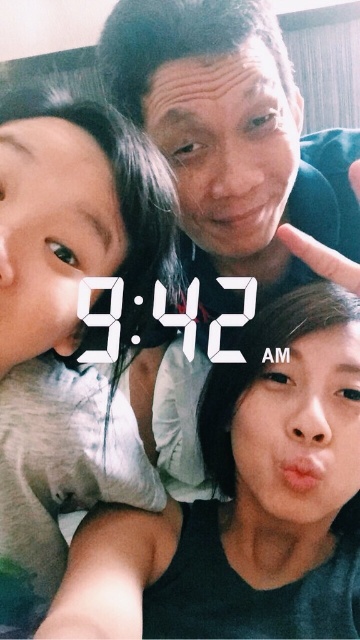
You are a photographer adjusting the lighting for a family portrait. You notice a point at coordinates (69, 326) on the image. Based on the scene description, what object does this point correspond to?

The point at coordinates (69, 326) corresponds to the light beige fabric shirt at left.

In the scene shown: You are trying to decide which clothing item to take for a casual day out. Based on the image, which clothing item has a smaller width between the light beige fabric shirt at left and the black matte tank top at lower right?

The light beige fabric shirt at left has a smaller width than the black matte tank top at lower right.